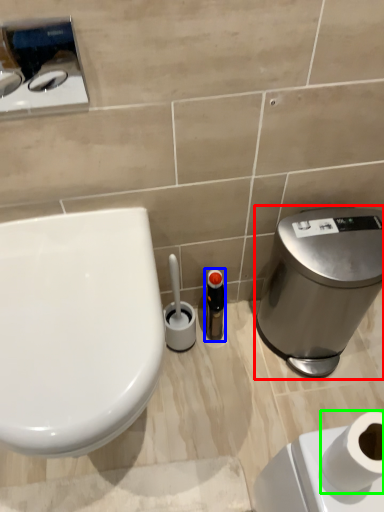
Question: Estimate the real-world distances between objects in this image. Which object is farther from water cooler (highlighted by a red box), toiletry (highlighted by a blue box) or toilet paper (highlighted by a green box)?

Choices:
 (A) toiletry
 (B) toilet paper

Answer: (B)